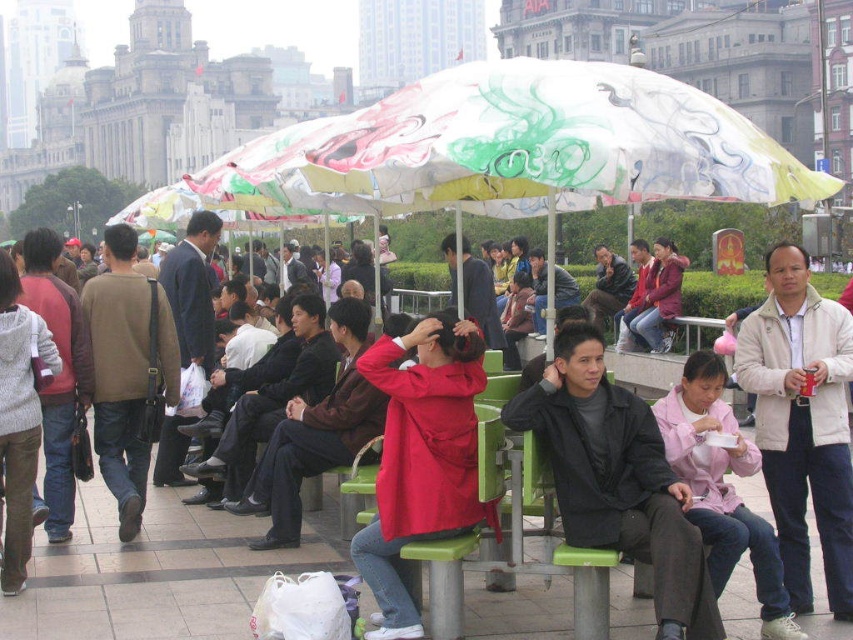
Between point (822, 515) and point (15, 458), which one is positioned behind?

The point (15, 458) is behind.

Which is behind, point (770, 266) or point (25, 548)?

The point (770, 266) is more distant.

You are a GUI agent. You are given a task and a screenshot of the screen. Output one action in this format:
    pyautogui.click(x=<x>, y=<y>)
    Task: Click on the light beige jacket at center
    The width and height of the screenshot is (853, 640).
    Given the screenshot: What is the action you would take?
    pyautogui.click(x=802, y=422)

Does matte black jacket at center appear on the right side of light beige jacket at center?

Incorrect, matte black jacket at center is not on the right side of light beige jacket at center.

Can you confirm if matte black jacket at center is smaller than light beige jacket at center?

No, matte black jacket at center is not smaller than light beige jacket at center.

Does point (583, 378) come farther from viewer compared to point (838, 406)?

No, (583, 378) is in front of (838, 406).

Locate an element on the screen. Image resolution: width=853 pixels, height=640 pixels. matte black jacket at center is located at coordinates (618, 480).

Consider the image. Is brown leather jacket at left to the right of pink fabric jacket at lower right from the viewer's perspective?

Incorrect, brown leather jacket at left is not on the right side of pink fabric jacket at lower right.

What do you see at coordinates (126, 371) in the screenshot? I see `brown leather jacket at left` at bounding box center [126, 371].

This screenshot has height=640, width=853. Identify the location of brown leather jacket at left. (126, 371).